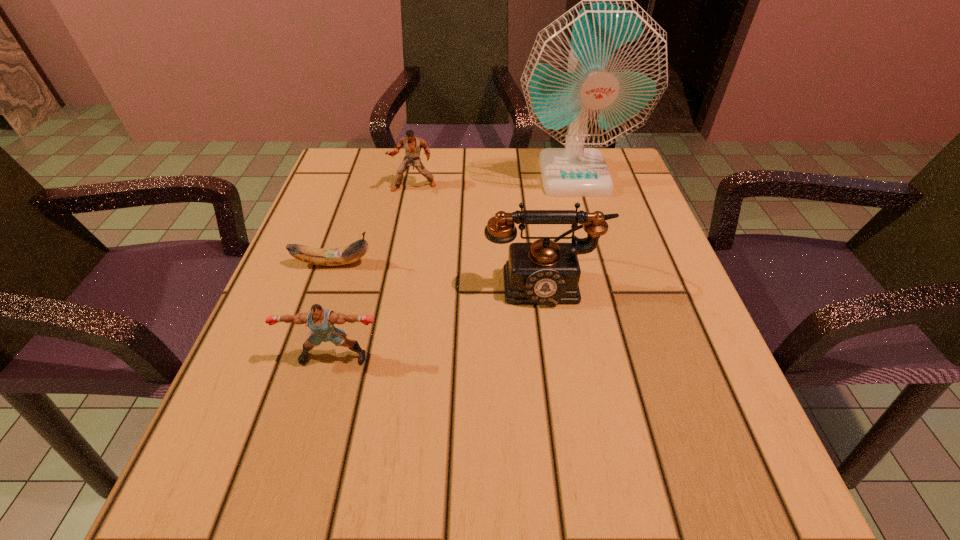
The width and height of the screenshot is (960, 540). I want to click on the tallest object, so click(594, 75).

You are a GUI agent. You are given a task and a screenshot of the screen. Output one action in this format:
    pyautogui.click(x=<x>, y=<y>)
    Task: Click on the fourth shortest object
    Image resolution: width=960 pixels, height=540 pixels.
    Given the screenshot: What is the action you would take?
    pyautogui.click(x=544, y=272)

Identify the location of the farther puncher. (412, 144).

The width and height of the screenshot is (960, 540). Find the location of `the shorter puncher`. the shorter puncher is located at coordinates (321, 321).

I want to click on the nearer puncher, so click(x=321, y=321).

I want to click on the shortest object, so click(348, 254).

Identify the location of free space located in front of the fan to face the airflow. The image size is (960, 540). (612, 316).

The height and width of the screenshot is (540, 960). Identify the location of free spot located on the front of the telephone at the rotary dial. (565, 428).

Where is `free space located 0.100m on the front-facing side of the farther puncher`? This screenshot has width=960, height=540. free space located 0.100m on the front-facing side of the farther puncher is located at coordinates (407, 220).

You are a GUI agent. You are given a task and a screenshot of the screen. Output one action in this format:
    pyautogui.click(x=<x>, y=<y>)
    Task: Click on the vacant space located on the front-facing side of the fourth tallest object
    This screenshot has width=960, height=540.
    Given the screenshot: What is the action you would take?
    pyautogui.click(x=302, y=470)